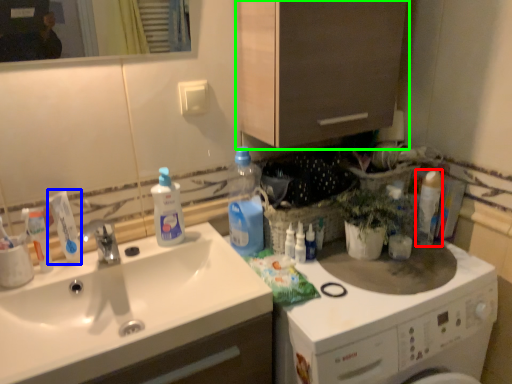
Question: Which object is the farthest from cleaning product (highlighted by a red box)? Choose among these: toothpaste (highlighted by a blue box) or cabinetry (highlighted by a green box).

Choices:
 (A) toothpaste
 (B) cabinetry

Answer: (A)